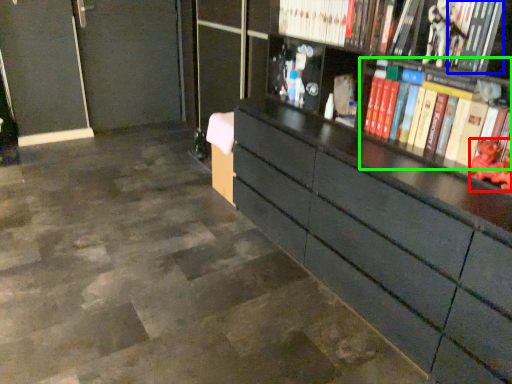
Question: Which object is the farthest from toy (highlighted by a red box)? Choose among these: book (highlighted by a blue box) or book (highlighted by a green box).

Choices:
 (A) book
 (B) book

Answer: (A)